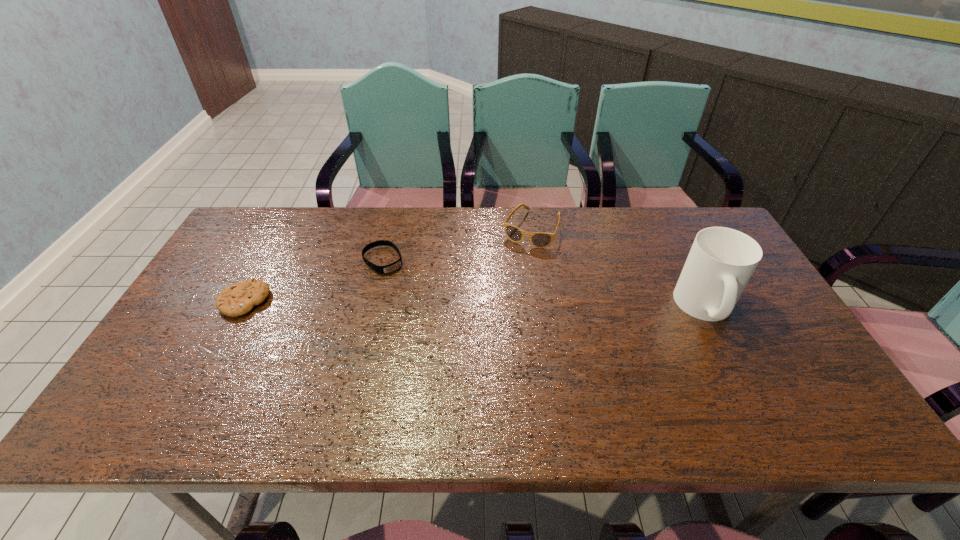
You are a GUI agent. You are given a task and a screenshot of the screen. Output one action in this format:
    pyautogui.click(x=<x>, y=<y>)
    Task: Click on the free area in between the tallest object and the shortest object
    
    Given the screenshot: What is the action you would take?
    pos(544,284)

Image resolution: width=960 pixels, height=540 pixels. In order to click on vacant space in between the cookie and the sunglasses in this screenshot , I will do `click(388, 265)`.

Where is `free point between the sunglasses and the wristband`? The height and width of the screenshot is (540, 960). free point between the sunglasses and the wristband is located at coordinates (457, 245).

Where is `free point between the second tallest object and the leftmost object`? This screenshot has height=540, width=960. free point between the second tallest object and the leftmost object is located at coordinates (388, 265).

Where is `vacant area that lies between the cookie and the sunglasses`? The height and width of the screenshot is (540, 960). vacant area that lies between the cookie and the sunglasses is located at coordinates (388, 265).

Identify which object is located as the third nearest to the third object from left to right. Please provide its 2D coordinates. Your answer should be formatted as a tuple, i.e. [(x, y)], where the tuple contains the x and y coordinates of a point satisfying the conditions above.

[(237, 299)]

Locate an element on the screen. This screenshot has height=540, width=960. the second closest object to the wristband is located at coordinates pyautogui.click(x=538, y=239).

Identify the location of vacant region that satisfies the following two spatial constraints: 1. on the back side of the shortest object; 2. on the left side of the cookie. (267, 260).

The image size is (960, 540). Find the location of `vacant region that satisfies the following two spatial constraints: 1. on the back side of the third object from right to left; 2. on the left side of the third shortest object`. vacant region that satisfies the following two spatial constraints: 1. on the back side of the third object from right to left; 2. on the left side of the third shortest object is located at coordinates coord(391,228).